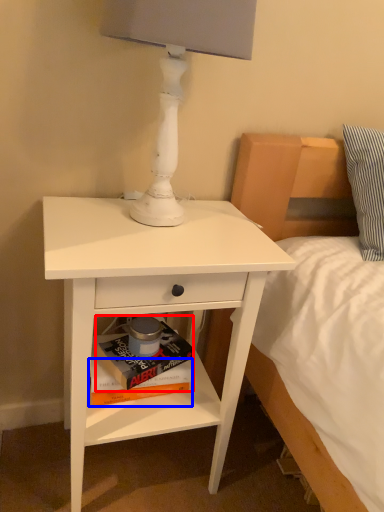
Question: Among these objects, which one is farthest to the camera, paperback book (highlighted by a red box) or paperback book (highlighted by a blue box)?

Choices:
 (A) paperback book
 (B) paperback book

Answer: (B)